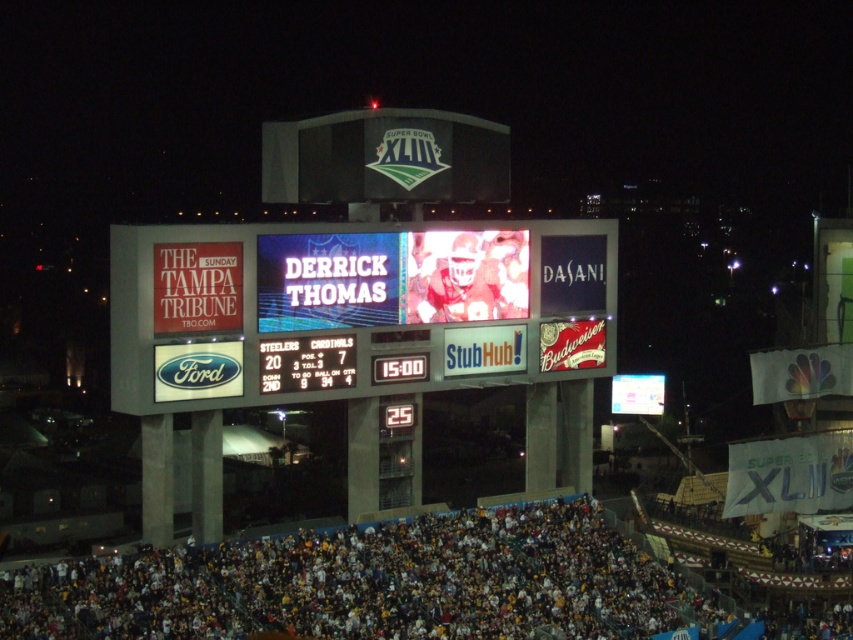
Between point (515, 241) and point (386, 566), which one is positioned behind?

The point (515, 241) is behind.

The height and width of the screenshot is (640, 853). I want to click on led digital display at center, so click(x=354, y=308).